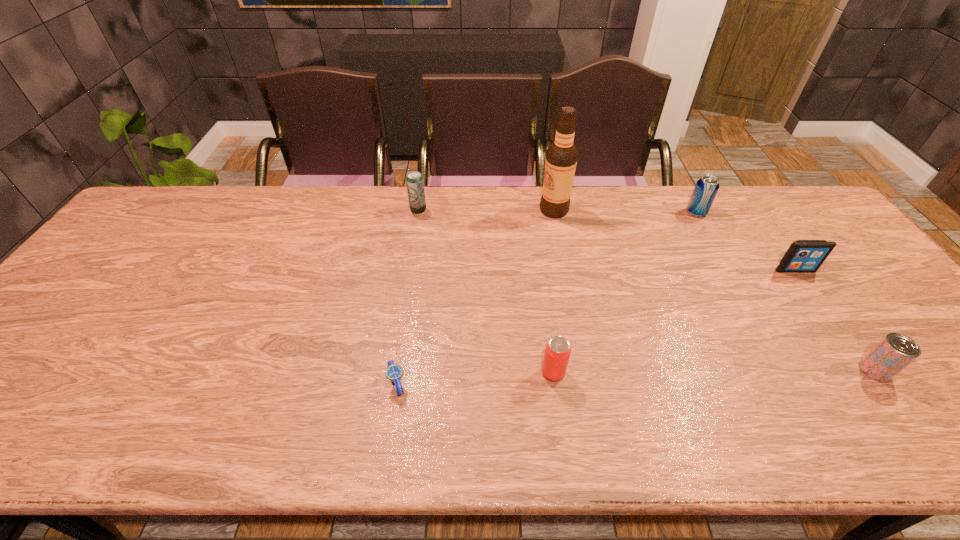
You are a GUI agent. You are given a task and a screenshot of the screen. Output one action in this format:
    pyautogui.click(x=<x>, y=<y>)
    Task: Click on the free space that satisfies the following two spatial constraints: 1. on the back side of the watch; 2. on the left side of the fifth object from left to right
    
    Given the screenshot: What is the action you would take?
    pyautogui.click(x=422, y=212)

Locate an element on the screen. vacant space that satisfies the following two spatial constraints: 1. on the label of the tallest object; 2. on the right side of the rightmost beer can is located at coordinates (585, 370).